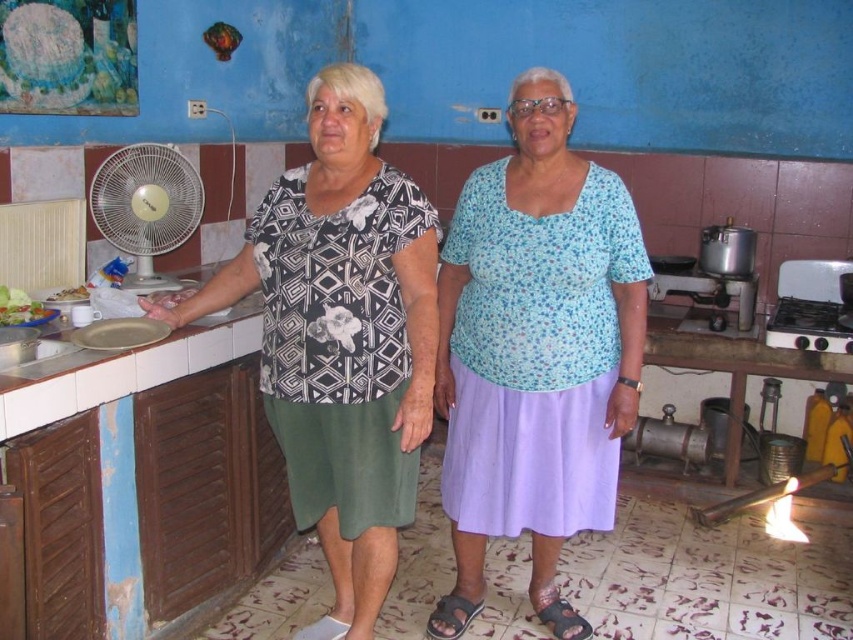
Question: Can you confirm if blue floral blouse at center is thinner than white plastic fan at left?

Choices:
 (A) no
 (B) yes

Answer: (A)

Question: Which point is farther to the camera?

Choices:
 (A) white plastic fan at left
 (B) blue floral blouse at center
 (C) smooth white plate at left

Answer: (A)

Question: Can you confirm if white plastic fan at left is wider than white glossy sink at lower left?

Choices:
 (A) yes
 (B) no

Answer: (A)

Question: Which point is closer to the camera?

Choices:
 (A) (86, 296)
 (B) (372, 116)

Answer: (B)

Question: Is matte black blouse at center thinner than smooth white plate at left?

Choices:
 (A) yes
 (B) no

Answer: (B)

Question: Which point is closer to the camera?

Choices:
 (A) matte black blouse at center
 (B) blue floral blouse at center

Answer: (A)